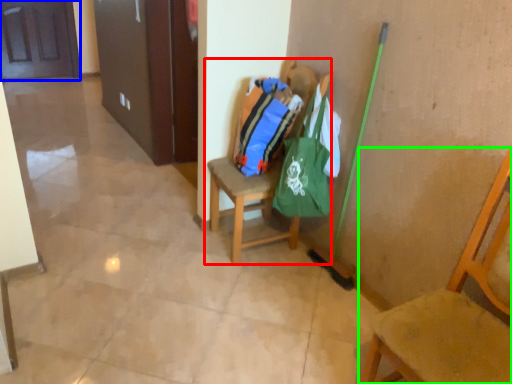
Question: Based on their relative distances, which object is farther from chair (highlighted by a red box)? Choose from door (highlighted by a blue box) and chair (highlighted by a green box).

Choices:
 (A) door
 (B) chair

Answer: (A)